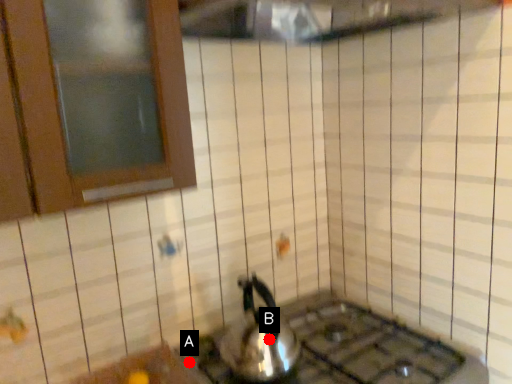
Question: Two points are circled on the image, labeled by A and B beside each circle. Which point is closer to the camera?

Choices:
 (A) A is closer
 (B) B is closer

Answer: (B)